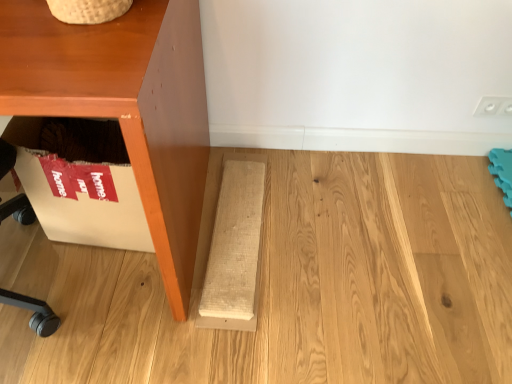
Question: Looking at the image, does matte brown cabinet at left seem bigger or smaller compared to natural wood plank at lower center?

Choices:
 (A) big
 (B) small

Answer: (A)

Question: Considering the relative positions of matte brown cabinet at left and natural wood plank at lower center in the image provided, is matte brown cabinet at left to the left or to the right of natural wood plank at lower center?

Choices:
 (A) right
 (B) left

Answer: (B)

Question: Does point click(70, 87) appear closer or farther from the camera than point click(214, 244)?

Choices:
 (A) closer
 (B) farther

Answer: (A)

Question: Considering their positions, is natural wood plank at lower center located in front of or behind matte brown cabinet at left?

Choices:
 (A) front
 (B) behind

Answer: (B)

Question: Is natural wood plank at lower center taller or shorter than matte brown cabinet at left?

Choices:
 (A) short
 (B) tall

Answer: (A)

Question: Visually, is natural wood plank at lower center positioned to the left or to the right of matte brown cabinet at left?

Choices:
 (A) right
 (B) left

Answer: (A)

Question: Looking at their shapes, would you say natural wood plank at lower center is wider or thinner than matte brown cabinet at left?

Choices:
 (A) wide
 (B) thin

Answer: (B)